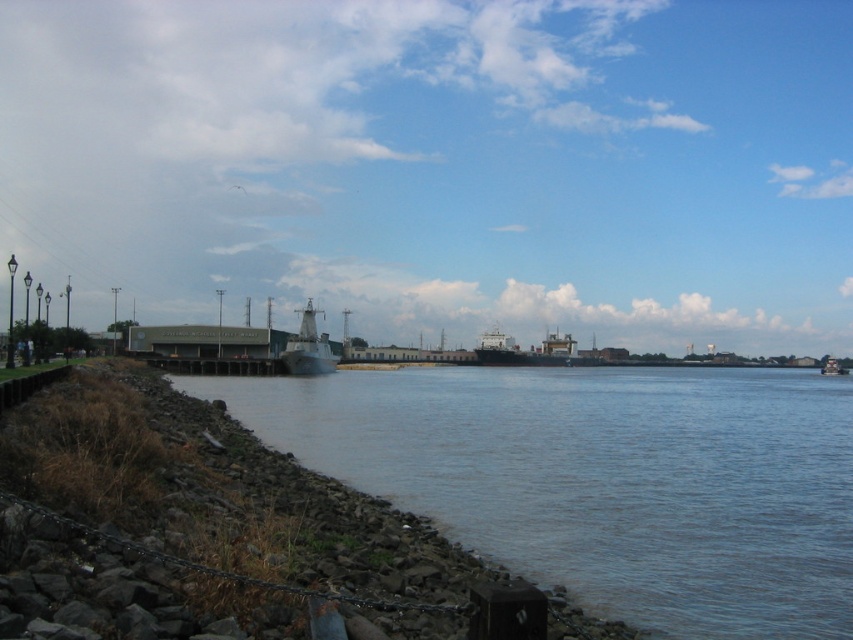
Question: Can you confirm if gray stone river at lower left is positioned above metallic gray ship at center?

Choices:
 (A) yes
 (B) no

Answer: (B)

Question: Is gray stone river at lower left wider than metallic gray ship at center?

Choices:
 (A) yes
 (B) no

Answer: (A)

Question: Does gray stone river at lower left appear under metallic gray ship at center?

Choices:
 (A) yes
 (B) no

Answer: (A)

Question: Which object is closer to the camera taking this photo?

Choices:
 (A) gray stone river at lower left
 (B) metallic gray ship at center

Answer: (A)

Question: Which object appears farthest from the camera in this image?

Choices:
 (A) gray stone river at lower left
 (B) metallic gray ship at center

Answer: (B)

Question: Which point is closer to the camera?

Choices:
 (A) (694, 378)
 (B) (312, 352)

Answer: (B)